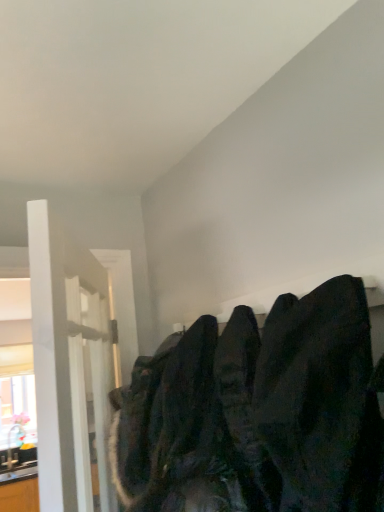
Question: Can you confirm if dark matte sweatshirt at upper right is wider than dark fabric coat at upper right?

Choices:
 (A) no
 (B) yes

Answer: (B)

Question: Is dark matte sweatshirt at upper right taller than dark fabric coat at upper right?

Choices:
 (A) yes
 (B) no

Answer: (A)

Question: Is dark fabric coat at upper right at the back of dark matte sweatshirt at upper right?

Choices:
 (A) no
 (B) yes

Answer: (A)

Question: Is dark fabric coat at upper right a part of dark matte sweatshirt at upper right?

Choices:
 (A) yes
 (B) no

Answer: (B)

Question: Could you tell me if dark matte sweatshirt at upper right is turned towards dark fabric coat at upper right?

Choices:
 (A) yes
 (B) no

Answer: (B)

Question: From the image's perspective, is dark matte sweatshirt at upper right above dark fabric coat at upper right?

Choices:
 (A) yes
 (B) no

Answer: (B)

Question: Is white glossy door at left thinner than dark fabric coat at upper right?

Choices:
 (A) no
 (B) yes

Answer: (B)

Question: Does white glossy door at left have a greater width compared to dark fabric coat at upper right?

Choices:
 (A) yes
 (B) no

Answer: (B)

Question: Is white glossy door at left behind dark fabric coat at upper right?

Choices:
 (A) yes
 (B) no

Answer: (A)

Question: Is white glossy door at left looking in the opposite direction of dark fabric coat at upper right?

Choices:
 (A) yes
 (B) no

Answer: (B)

Question: Is white glossy door at left not close to dark fabric coat at upper right?

Choices:
 (A) yes
 (B) no

Answer: (B)

Question: Considering the relative sizes of white glossy door at left and dark fabric coat at upper right in the image provided, is white glossy door at left bigger than dark fabric coat at upper right?

Choices:
 (A) no
 (B) yes

Answer: (B)

Question: Is the position of dark matte sweatshirt at upper right more distant than that of white glossy door at left?

Choices:
 (A) yes
 (B) no

Answer: (B)